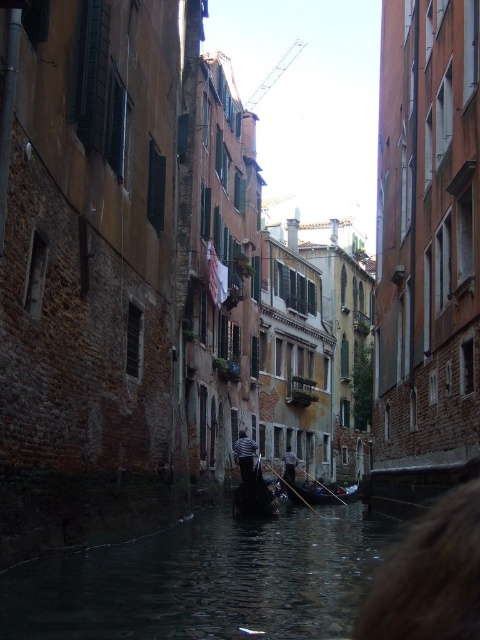
You are a tourist standing on the canal bridge and want to take a photo of the wooden gondola at center and the striped shirt at center. Which object is wider in the image?

The wooden gondola at center is wider than the striped shirt at center.

You are a photographer wanting to capture both the striped shirt at center and the dark gray fabric shirt at center in a single frame. Given the narrow canal and the buildings on both sides, will the distance between the two shirts allow you to fit both in your camera frame without moving closer or further away?

The striped shirt at center has a lesser width compared to the dark gray fabric shirt at center, but the distance between them isn not specified in the provided information. Therefore, it is impossible to determine if they can both fit in the frame based solely on their widths.